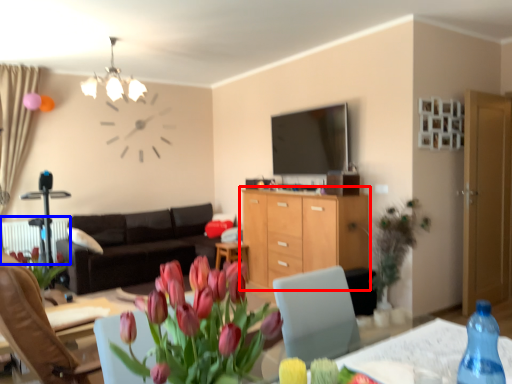
Question: Among these objects, which one is nearest to the camera, cabinetry (highlighted by a red box) or radiator (highlighted by a blue box)?

Choices:
 (A) cabinetry
 (B) radiator

Answer: (A)